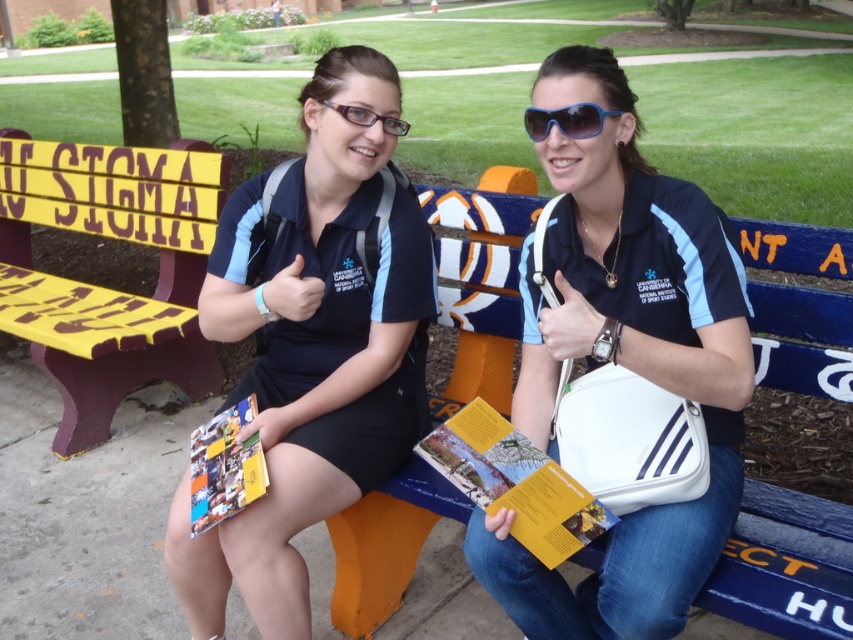
Question: Which object is positioned closest to the blue painted wood bench at center?

Choices:
 (A) yellow paper brochure at center
 (B) white synthetic bag at center

Answer: (A)

Question: Can you confirm if blue painted wood bench at center is smaller than yellow paper brochure at center?

Choices:
 (A) yes
 (B) no

Answer: (B)

Question: Is white synthetic bag at center thinner than blue painted wood bench at center?

Choices:
 (A) yes
 (B) no

Answer: (A)

Question: Does yellow painted wood bench at upper left have a larger size compared to matte plastic magazine at center?

Choices:
 (A) yes
 (B) no

Answer: (A)

Question: Which object appears closest to the camera in this image?

Choices:
 (A) blue plastic sunglasses at center
 (B) yellow paper brochure at center
 (C) yellow painted wood bench at upper left
 (D) matte purple glasses at center

Answer: (B)

Question: Which of the following is the closest to the observer?

Choices:
 (A) (759, 317)
 (B) (602, 109)
 (C) (409, 376)
 (D) (198, 438)

Answer: (B)